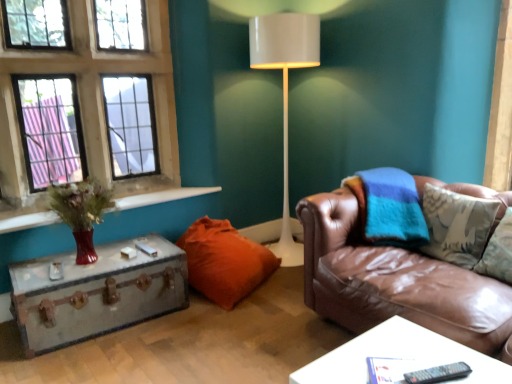
You are a GUI agent. You are given a task and a screenshot of the screen. Output one action in this format:
    pyautogui.click(x=<x>, y=<y>)
    Task: Click on the vacant space situated above white glossy table at lower right, positioned as the second table in left-to-right order (from a real-world perspective)
    
    Given the screenshot: What is the action you would take?
    pyautogui.click(x=399, y=351)